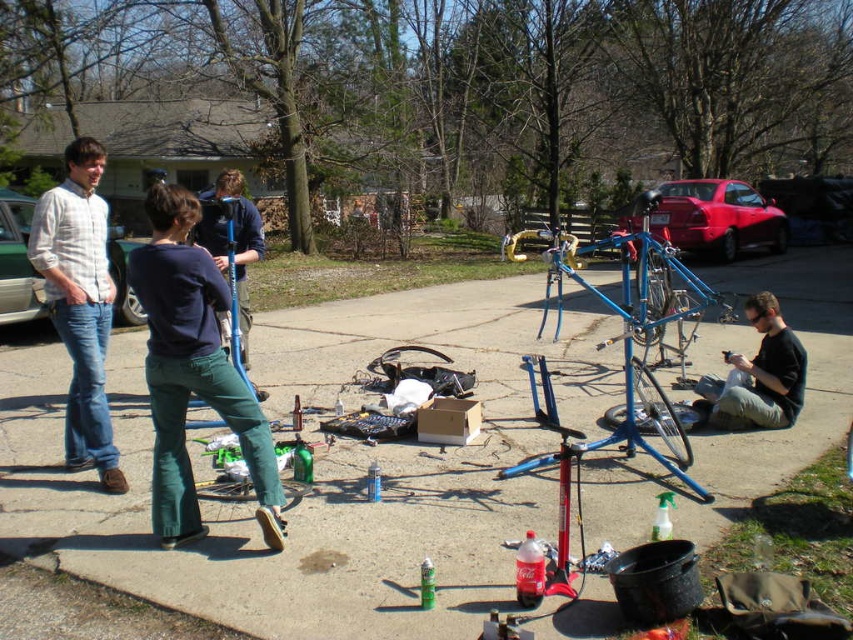
You are standing in the driveway where the bicycles are being worked on. There are two points marked in the scene. The first point is at coordinates point (90, 202), and the second is at point (788, 364). Which of these two points is closer to your current position?

Point (90, 202) is closer to the camera than point (788, 364), so the first point is closer to your current position.

Please describe the location of the dark blue shirt at center in the image using coordinates. The coordinate system has the origin at the bottom left corner of the image, with the x and y axes increasing to the right and up respectively. The coordinates are normalized between 0 and 1.

The dark blue shirt at center is located at coordinates approximately at point 0.580 in the x direction and 0.227 in the y direction.